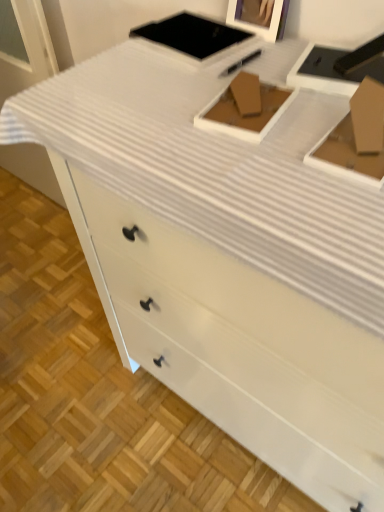
Question: Considering the positions of brown cardboard box at center and wooden picture frame at upper center in the image, is brown cardboard box at center wider or thinner than wooden picture frame at upper center?

Choices:
 (A) wide
 (B) thin

Answer: (A)

Question: Considering the positions of point (273, 122) and point (283, 17), is point (273, 122) closer or farther from the camera than point (283, 17)?

Choices:
 (A) farther
 (B) closer

Answer: (B)

Question: From the image's perspective, is brown cardboard box at center above or below wooden picture frame at upper center?

Choices:
 (A) above
 (B) below

Answer: (B)

Question: Considering the positions of wooden picture frame at upper center and brown cardboard box at center in the image, is wooden picture frame at upper center bigger or smaller than brown cardboard box at center?

Choices:
 (A) small
 (B) big

Answer: (B)

Question: Is wooden picture frame at upper center spatially inside brown cardboard box at center, or outside of it?

Choices:
 (A) inside
 (B) outside

Answer: (B)

Question: Considering the positions of wooden picture frame at upper center and brown cardboard box at center in the image, is wooden picture frame at upper center wider or thinner than brown cardboard box at center?

Choices:
 (A) wide
 (B) thin

Answer: (B)

Question: Visually, is wooden picture frame at upper center positioned to the left or to the right of brown cardboard box at center?

Choices:
 (A) left
 (B) right

Answer: (B)